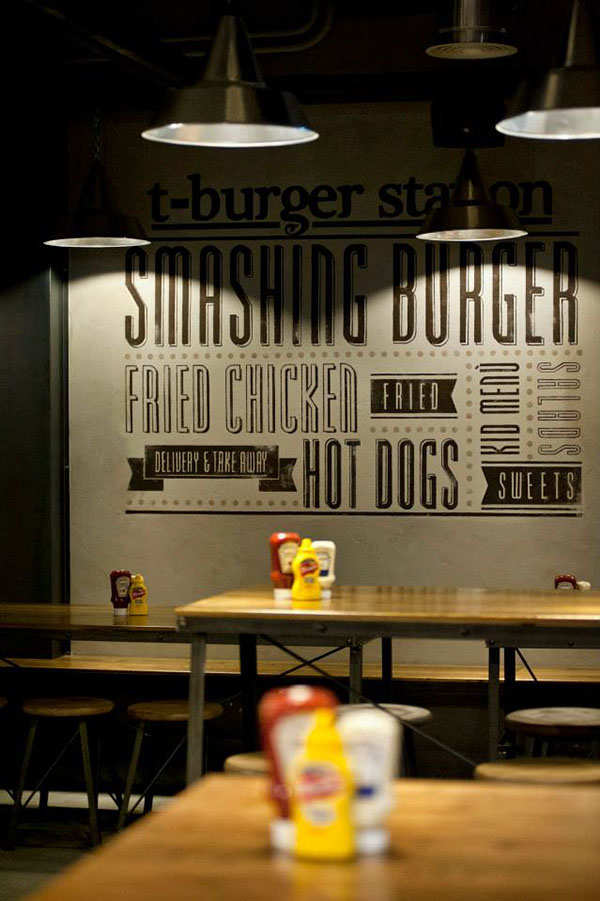
This screenshot has width=600, height=901. What are the coordinates of `table` in the screenshot? It's located at (489, 833), (445, 602), (87, 614).